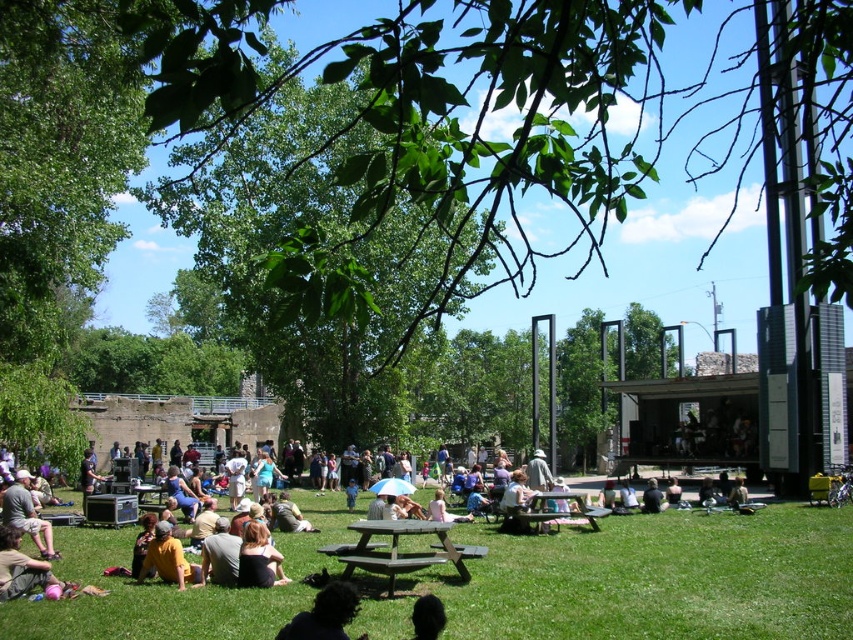
You are a photographer trying to capture a photo of the black hair at lower center without the green leafy tree at upper center blocking the view. Can you position yourself in a way that the tree is out of the frame?

The green leafy tree at upper center is larger than the black hair at lower center. Since the tree is positioned at the upper center, you can lower your camera angle to exclude the tree from the frame while focusing on the black hair at lower center.

You are at the park and see a matte yellow shirt at lower left and a green fabric person at center. Which object is closer to the ground?

The matte yellow shirt at lower left is positioned under the green fabric person at center, so it is closer to the ground.

You are a photographer trying to capture a clear shot of the black hair at lower center without any obstructions. Considering the green leafy tree at upper center, will you need to adjust your camera angle to avoid the tree blocking the view?

The green leafy tree at upper center is much taller than the black hair at lower center, so you will need to adjust your camera angle to avoid the tree blocking the view.